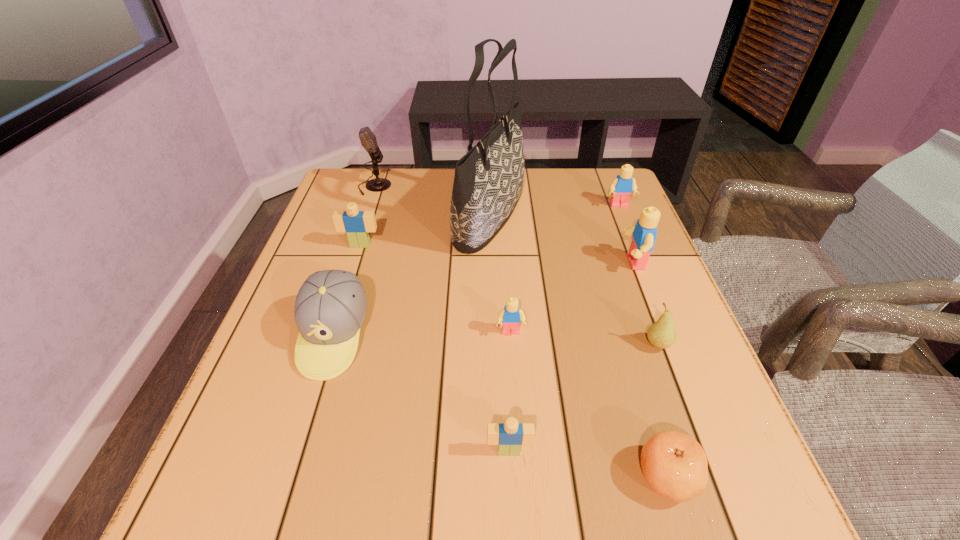
The height and width of the screenshot is (540, 960). In order to click on tote bag in this screenshot , I will do `click(488, 181)`.

This screenshot has width=960, height=540. I want to click on the tallest object, so coord(488,181).

I want to click on microphone, so click(x=368, y=140).

The width and height of the screenshot is (960, 540). Identify the location of the third tallest object. (644, 233).

Locate an element on the screen. the second nearest yellow Lego is located at coordinates (644, 233).

Find the location of a particular element. the left beige Lego is located at coordinates (356, 224).

The height and width of the screenshot is (540, 960). I want to click on the bigger beige Lego, so click(356, 224).

Find the location of `the second biggest yellow Lego`. the second biggest yellow Lego is located at coordinates (622, 186).

Find the location of `the farthest Lego`. the farthest Lego is located at coordinates (622, 186).

Locate an element on the screen. The width and height of the screenshot is (960, 540). baseball cap is located at coordinates (330, 308).